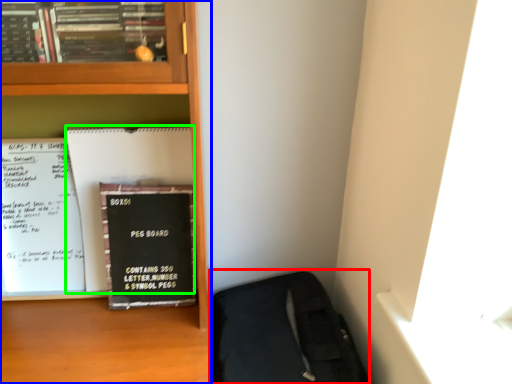
Question: Which is farther away from sleeping bag (highlighted by a red box)? bookcase (highlighted by a blue box) or paperback book (highlighted by a green box)?

Choices:
 (A) bookcase
 (B) paperback book

Answer: (B)